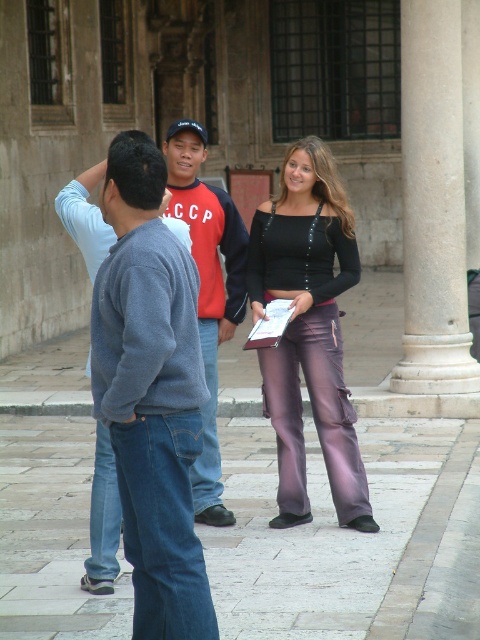
Based on the photo, who is positioned more to the left, purple satin pants at center or black matte sweatshirt at center?

purple satin pants at center

Between purple satin pants at center and black matte sweatshirt at center, which one appears on the right side from the viewer's perspective?

Positioned to the right is black matte sweatshirt at center.

Who is more forward, (x=229, y=317) or (x=314, y=221)?

Point (x=314, y=221) is more forward.

Where is `purple satin pants at center`? The image size is (480, 640). purple satin pants at center is located at coordinates (212, 320).

Is metallic purple pants at center below red cotton shirt at center?

Yes.

Between metallic purple pants at center and red cotton shirt at center, which one is positioned higher?

red cotton shirt at center is above.

Which is in front, point (278, 276) or point (203, 451)?

Positioned in front is point (203, 451).

Where is `metallic purple pants at center`? metallic purple pants at center is located at coordinates (309, 332).

Can you confirm if denim jeans at left is bigger than purple satin pants at center?

Indeed, denim jeans at left has a larger size compared to purple satin pants at center.

Who is more distant from viewer, (177,632) or (220,518)?

Point (220,518)

Between point (157, 573) and point (201, 477), which one is positioned behind?

The point (201, 477) is more distant.

Locate an element on the screen. This screenshot has height=640, width=480. denim jeans at left is located at coordinates (151, 394).